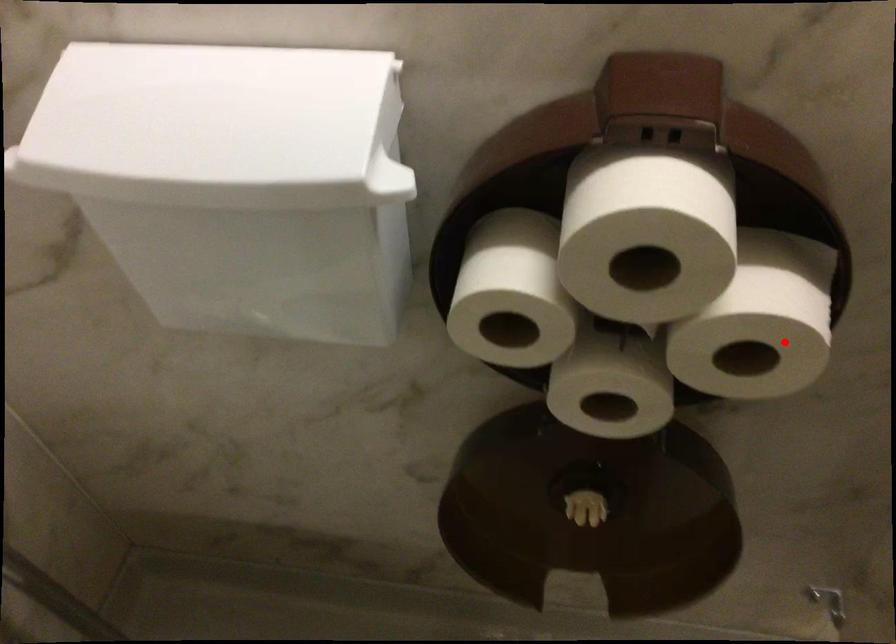
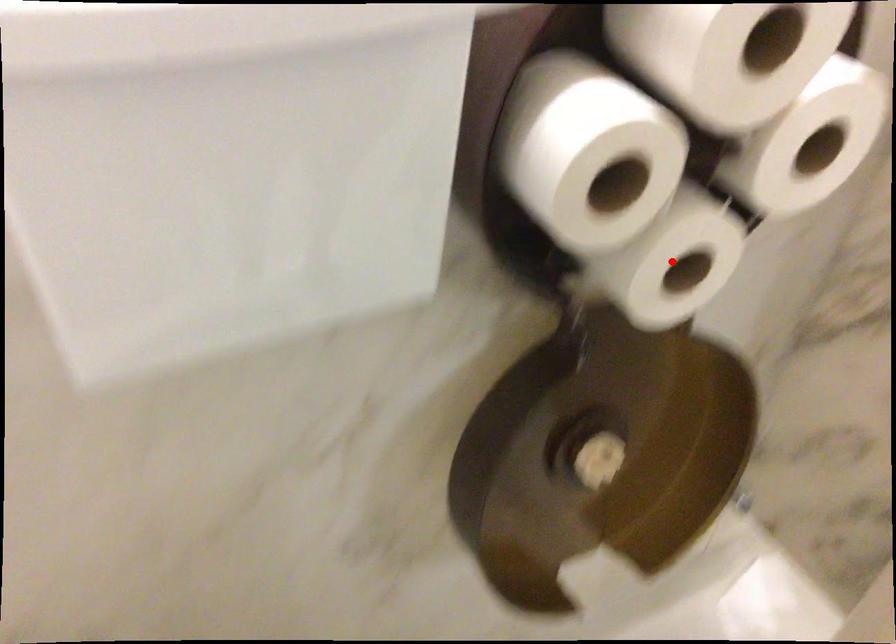
I am providing you with two images of the same scene from different viewpoints. A red point is marked on the first image and another point is marked on the second image. Do the highlighted points in image1 and image2 indicate the same real-world spot?

No